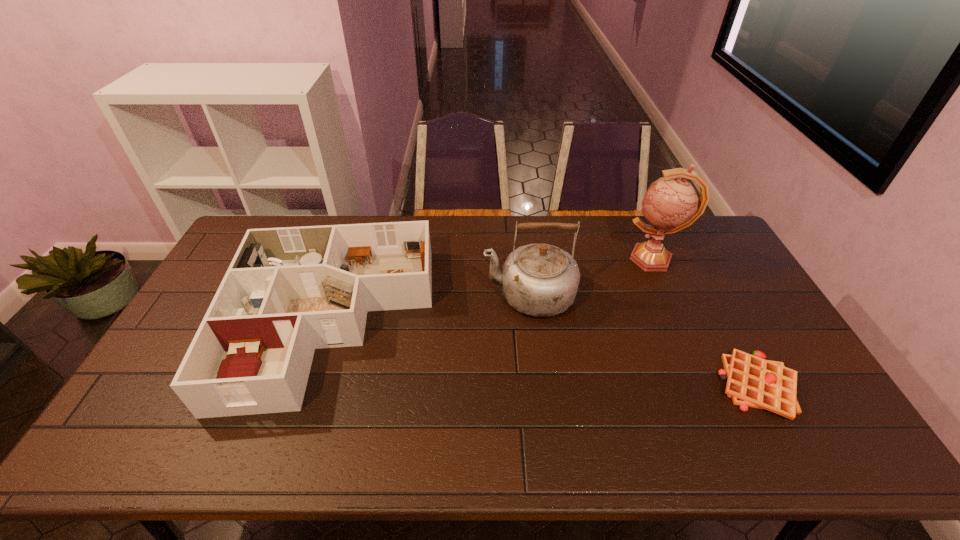
This screenshot has width=960, height=540. Find the location of `vacant area that lies between the second object from left to right and the tallest object`. vacant area that lies between the second object from left to right and the tallest object is located at coordinates (591, 277).

At what (x,y) coordinates should I click in order to perform the action: click on vacant region between the third object from right to left and the second shortest object. Please return your answer as a coordinate pair (x, y). The height and width of the screenshot is (540, 960). Looking at the image, I should click on (429, 308).

Image resolution: width=960 pixels, height=540 pixels. Identify the location of vacant area that lies between the shortest object and the second shortest object. (543, 354).

Point out which object is positioned as the nearest to the waffle. Please provide its 2D coordinates. Your answer should be formatted as a tuple, i.e. [(x, y)], where the tuple contains the x and y coordinates of a point satisfying the conditions above.

[(670, 204)]

Find the location of `object that is the second closest to the kettle`. object that is the second closest to the kettle is located at coordinates (670, 204).

I want to click on vacant region that satisfies the following two spatial constraints: 1. on the back side of the shortest object; 2. on the front-facing side of the tallest object, so click(689, 259).

I want to click on vacant area that satisfies the following two spatial constraints: 1. on the front-facing side of the shortest object; 2. on the right side of the tallest object, so click(x=709, y=386).

Image resolution: width=960 pixels, height=540 pixels. In order to click on free location that satisfies the following two spatial constraints: 1. on the front-facing side of the shortest object; 2. on the right side of the globe in this screenshot , I will do tap(709, 386).

Find the location of a particular element. vacant point that satisfies the following two spatial constraints: 1. on the back side of the second shortest object; 2. at the spout of the second object from left to right is located at coordinates (339, 295).